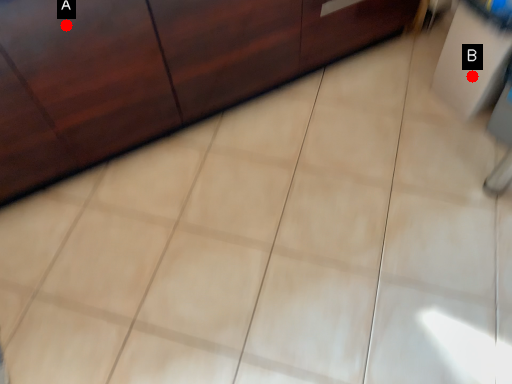
Question: Two points are circled on the image, labeled by A and B beside each circle. Which point is closer to the camera?

Choices:
 (A) A is closer
 (B) B is closer

Answer: (A)